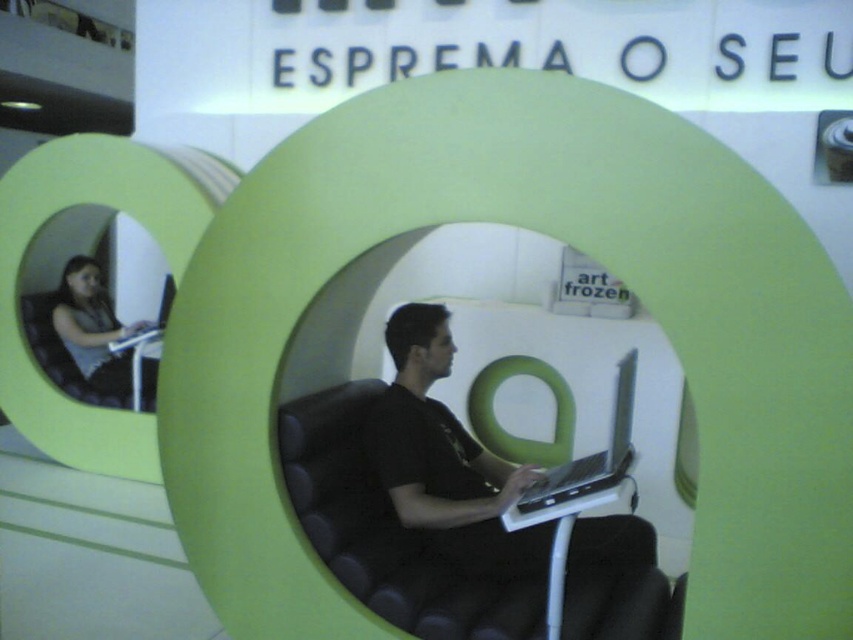
Does black leather chair at center have a lesser width compared to matte black laptop at left?

In fact, black leather chair at center might be wider than matte black laptop at left.

Can you confirm if black leather chair at center is bigger than matte black laptop at left?

Yes.

Which is in front, point (358, 433) or point (96, 374)?

Point (358, 433) is in front.

The height and width of the screenshot is (640, 853). What are the coordinates of `black leather chair at center` in the screenshot? It's located at (389, 531).

Does white plastic laptop at center have a lesser height compared to matte black laptop at left?

Yes.

Locate an element on the screen. white plastic laptop at center is located at coordinates (492, 548).

Where is `white plastic laptop at center`? white plastic laptop at center is located at coordinates (492, 548).

Is white plastic laptop at center below silver metallic laptop at center?

Yes, white plastic laptop at center is below silver metallic laptop at center.

Is white plastic laptop at center bigger than silver metallic laptop at center?

Actually, white plastic laptop at center might be smaller than silver metallic laptop at center.

Which is in front, point (485, 561) or point (628, 358)?

Positioned in front is point (628, 358).

What are the coordinates of `white plastic laptop at center` in the screenshot? It's located at (492, 548).